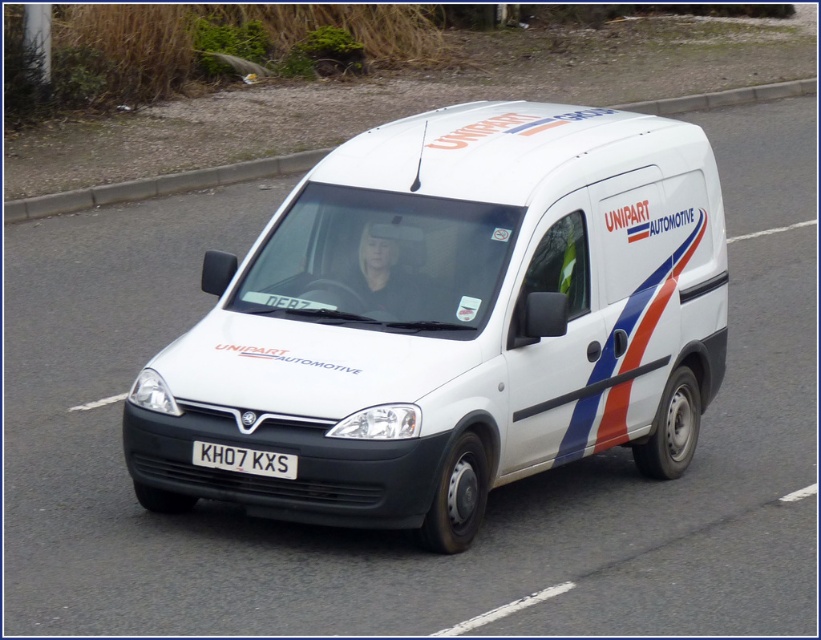
Question: Can you confirm if white matte van at center is positioned to the right of concrete at upper center?

Choices:
 (A) no
 (B) yes

Answer: (A)

Question: Considering the relative positions of white matte van at center and concrete at upper center in the image provided, where is white matte van at center located with respect to concrete at upper center?

Choices:
 (A) above
 (B) below

Answer: (B)

Question: Based on their relative distances, which object is nearer to the white matte van at center?

Choices:
 (A) white plastic license plate at center
 (B) concrete at upper center

Answer: (A)

Question: Estimate the real-world distances between objects in this image. Which object is farther from the white matte van at center?

Choices:
 (A) white plastic license plate at center
 (B) concrete at upper center

Answer: (B)

Question: Does white matte van at center have a smaller size compared to concrete at upper center?

Choices:
 (A) no
 (B) yes

Answer: (B)

Question: Which is farther from the concrete at upper center?

Choices:
 (A) white plastic license plate at center
 (B) white matte van at center

Answer: (A)